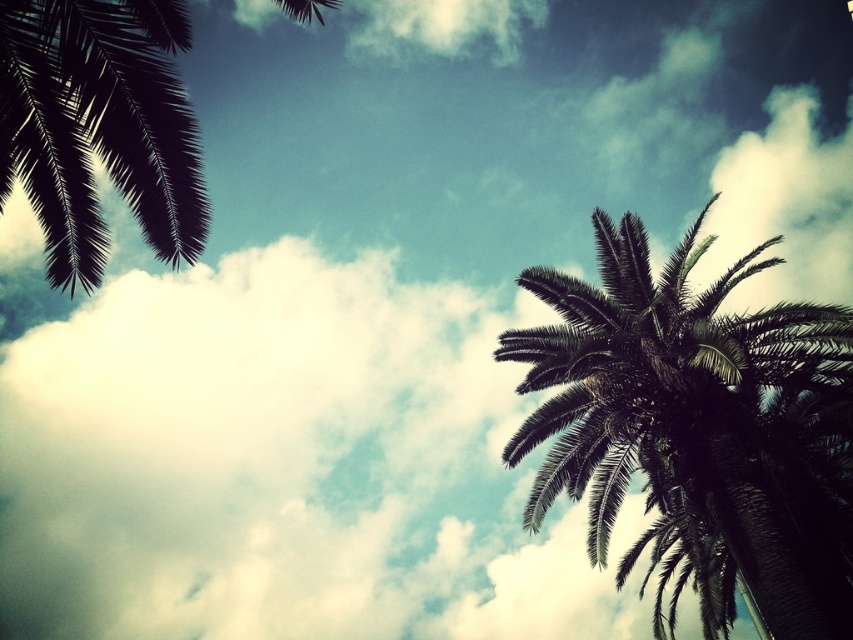
Question: Does dark green leafy palm tree at right have a larger size compared to dark green leafy palm tree at upper left?

Choices:
 (A) no
 (B) yes

Answer: (A)

Question: Where is dark green leafy palm tree at right located in relation to dark green leafy palm tree at upper left in the image?

Choices:
 (A) right
 (B) left

Answer: (A)

Question: Which point appears farthest from the camera in this image?

Choices:
 (A) (93, 10)
 (B) (527, 332)

Answer: (B)

Question: Can you confirm if dark green leafy palm tree at right is bigger than dark green leafy palm tree at upper left?

Choices:
 (A) no
 (B) yes

Answer: (A)

Question: Which object appears farthest from the camera in this image?

Choices:
 (A) dark green leafy palm tree at upper left
 (B) dark green leafy palm tree at right

Answer: (B)